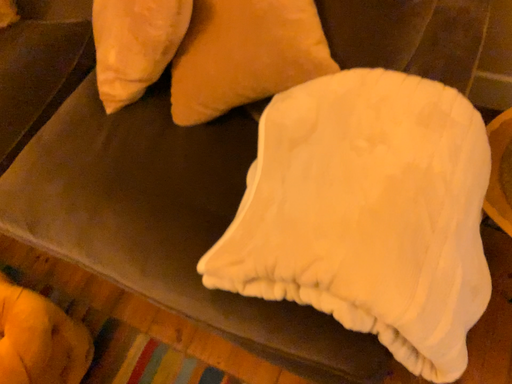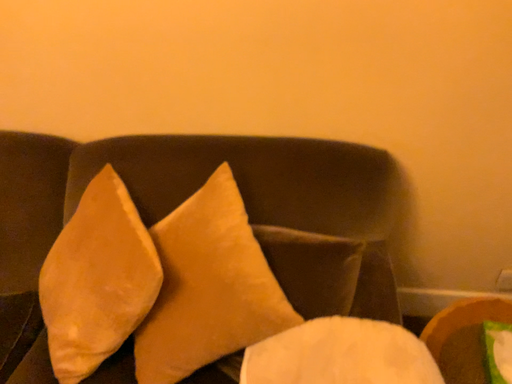
Question: Which way did the camera rotate in the video?

Choices:
 (A) rotated left
 (B) rotated right

Answer: (B)